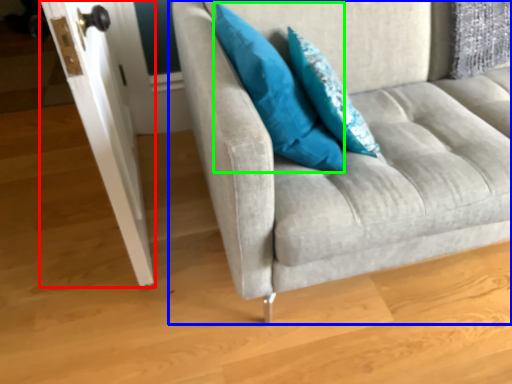
Question: Which object is positioned closest to door (highlighted by a red box)? Select from studio couch (highlighted by a blue box) and pillow (highlighted by a green box).

Choices:
 (A) studio couch
 (B) pillow

Answer: (B)